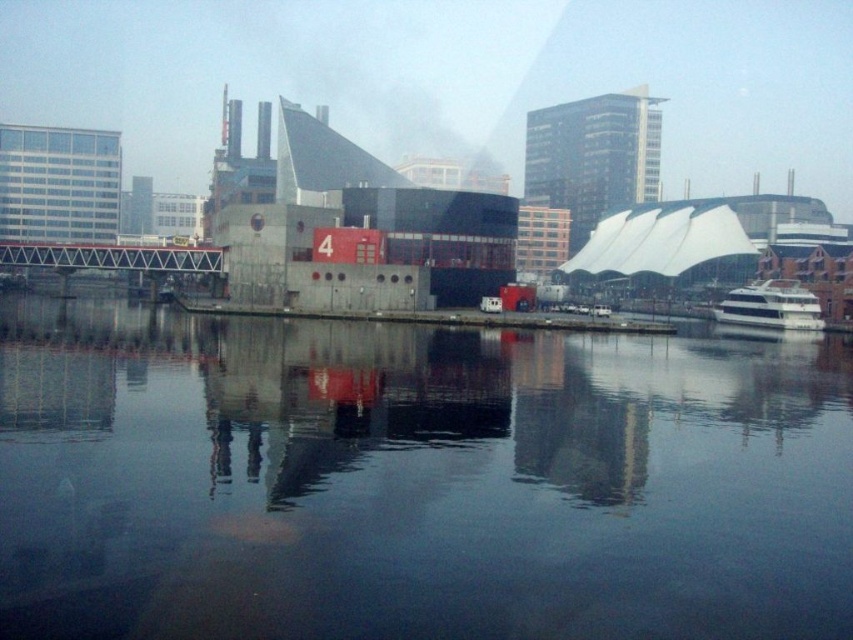
Can you confirm if red concrete building at center is thinner than white glossy boat at right?

No, red concrete building at center is not thinner than white glossy boat at right.

Can you confirm if red concrete building at center is taller than white glossy boat at right?

Yes, red concrete building at center is taller than white glossy boat at right.

Is point (316, 304) positioned behind point (740, 314)?

No, it is in front of (740, 314).

At what (x,y) coordinates should I click in order to perform the action: click on red concrete building at center. Please return your answer as a coordinate pair (x, y). Looking at the image, I should click on (361, 232).

From the picture: How far apart are transparent glass water at center and red concrete building at center?

transparent glass water at center is 42.03 meters away from red concrete building at center.

Is transparent glass water at center shorter than red concrete building at center?

Yes, transparent glass water at center is shorter than red concrete building at center.

Is point (4, 419) in front of point (280, 180)?

Yes, it is.

Where is `transparent glass water at center`? transparent glass water at center is located at coordinates (415, 481).

Image resolution: width=853 pixels, height=640 pixels. I want to click on transparent glass water at center, so click(x=415, y=481).

Can you confirm if transparent glass water at center is positioned above white glossy boat at right?

Actually, transparent glass water at center is below white glossy boat at right.

Find the location of `transparent glass water at center`. transparent glass water at center is located at coordinates (415, 481).

Where is `transparent glass water at center`? The width and height of the screenshot is (853, 640). transparent glass water at center is located at coordinates (415, 481).